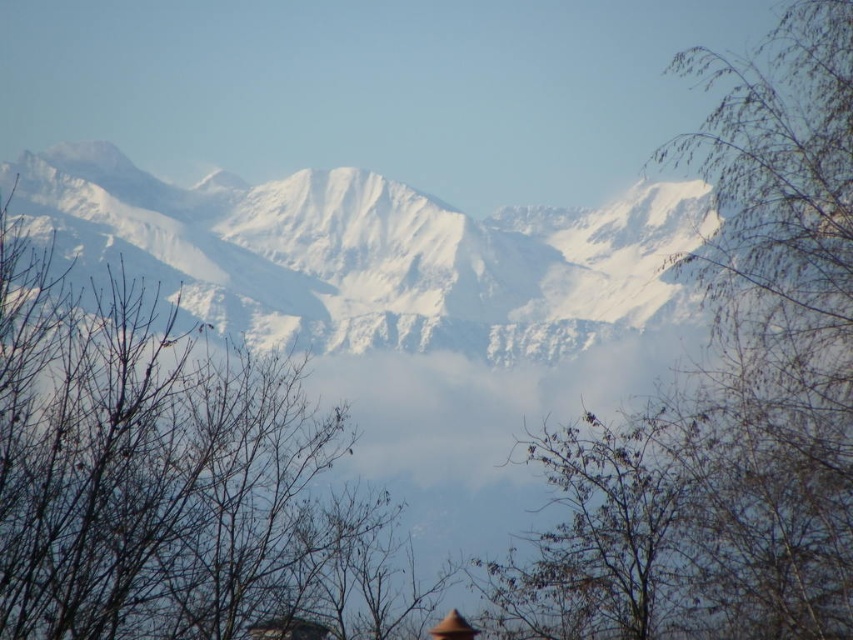
You are an artist trying to paint the mountain scene. You want to place a small bird on the bare branches at upper right. Where exactly should you paint the bird?

You should paint the bird at the position of the bare branches at upper right located at point (728,394).

You are an artist trying to paint the mountain scene. You notice two sets of bare branches in the image. Which set of bare branches at upper right or bare branches at center would you paint first if you want to follow the rule of painting smaller objects before larger ones?

The bare branches at upper right should be painted first because they are smaller in size compared to the bare branches at center.